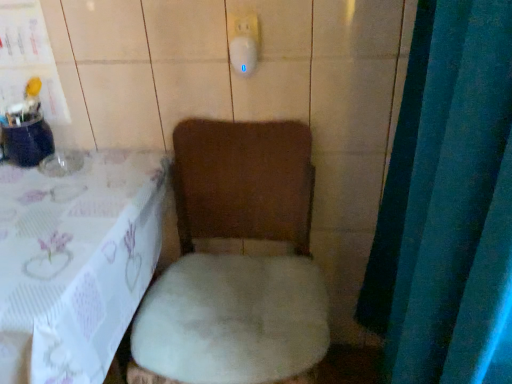
Question: Is white plush toilet at center at the left side of white plush chair at lower left?

Choices:
 (A) yes
 (B) no

Answer: (B)

Question: From the image's perspective, does white plush toilet at center appear higher than white plush chair at lower left?

Choices:
 (A) no
 (B) yes

Answer: (B)

Question: Is white plush toilet at center thinner than white plush chair at lower left?

Choices:
 (A) yes
 (B) no

Answer: (A)

Question: Considering the relative sizes of white plush toilet at center and white plush chair at lower left in the image provided, is white plush toilet at center bigger than white plush chair at lower left?

Choices:
 (A) no
 (B) yes

Answer: (A)

Question: From a real-world perspective, is white plush toilet at center on top of white plush chair at lower left?

Choices:
 (A) no
 (B) yes

Answer: (B)

Question: From the image's perspective, is white plush chair at lower left above or below white plush toilet at center?

Choices:
 (A) above
 (B) below

Answer: (B)

Question: Is white plush chair at lower left bigger or smaller than white plush toilet at center?

Choices:
 (A) small
 (B) big

Answer: (B)

Question: Looking at their shapes, would you say white plush chair at lower left is wider or thinner than white plush toilet at center?

Choices:
 (A) wide
 (B) thin

Answer: (A)

Question: Is white plush chair at lower left inside or outside of white plush toilet at center?

Choices:
 (A) inside
 (B) outside

Answer: (B)

Question: Looking at the image, does blue fabric curtain at right seem bigger or smaller compared to white plush chair at lower left?

Choices:
 (A) big
 (B) small

Answer: (B)

Question: From a real-world perspective, is blue fabric curtain at right positioned above or below white plush chair at lower left?

Choices:
 (A) above
 (B) below

Answer: (A)

Question: Visually, is blue fabric curtain at right positioned to the left or to the right of white plush chair at lower left?

Choices:
 (A) right
 (B) left

Answer: (A)

Question: From the image's perspective, relative to white plush chair at lower left, is blue fabric curtain at right above or below?

Choices:
 (A) above
 (B) below

Answer: (A)

Question: Is blue fabric curtain at right taller or shorter than white plush toilet at center?

Choices:
 (A) short
 (B) tall

Answer: (B)

Question: Is blue fabric curtain at right situated inside white plush toilet at center or outside?

Choices:
 (A) inside
 (B) outside

Answer: (B)